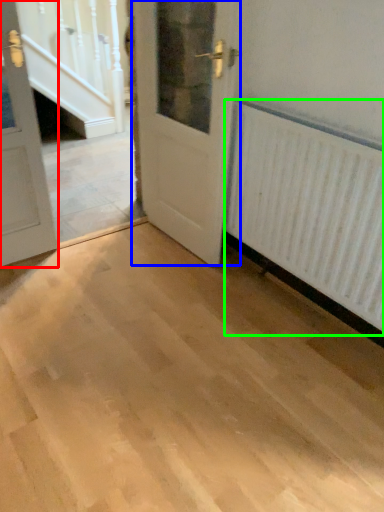
Question: Estimate the real-world distances between objects in this image. Which object is closer to door (highlighted by a red box), door (highlighted by a blue box) or radiator (highlighted by a green box)?

Choices:
 (A) door
 (B) radiator

Answer: (A)